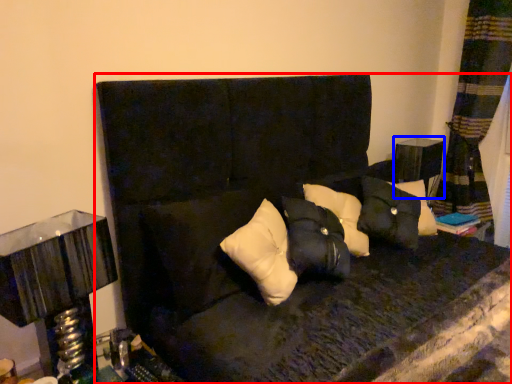
Question: Which point is further to the camera, furniture (highlighted by a red box) or table (highlighted by a blue box)?

Choices:
 (A) furniture
 (B) table

Answer: (B)